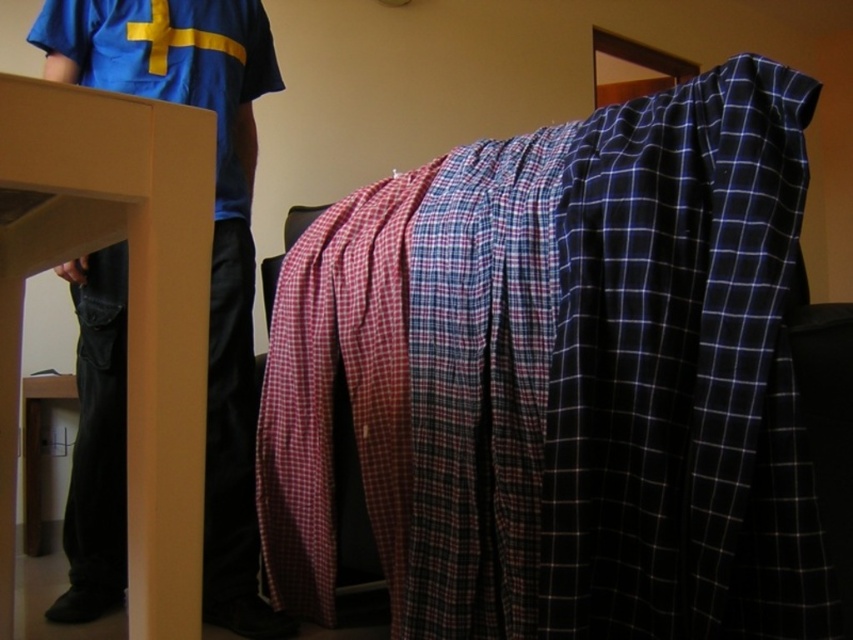
You need to determine which object is bigger between the plaid fabric blanket at center and the blue cotton shirt at upper left. Which one is larger?

The plaid fabric blanket at center has a larger size compared to the blue cotton shirt at upper left, so the plaid fabric blanket at center is bigger.

You are in a room and want to determine which of the two points, point (596, 246) or point (219, 12), is closer to you. Based on the scene, which point is nearer?

Point (596, 246) is closer to the camera than point (219, 12), so it is nearer to you.

You are a delivery robot with a package that is 24 inches wide. You need to move from the blue cotton shirt at upper left to the plaid fabric blanket at center. Is there enough space for your package to fit between them?

The distance between the blue cotton shirt at upper left and the plaid fabric blanket at center is 23.01 inches. Since your package is 24 inches wide, it is slightly too wide to fit through the space between them.